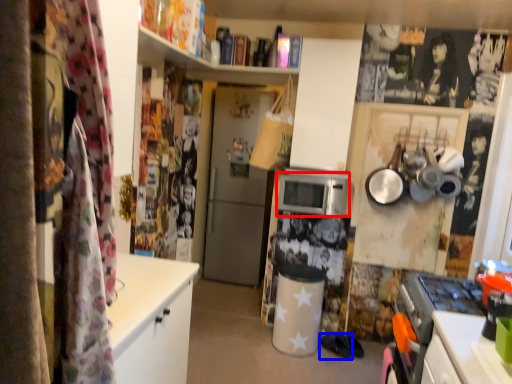
Question: Which object appears farthest to the camera in this image, microwave oven (highlighted by a red box) or footwear (highlighted by a blue box)?

Choices:
 (A) microwave oven
 (B) footwear

Answer: (B)